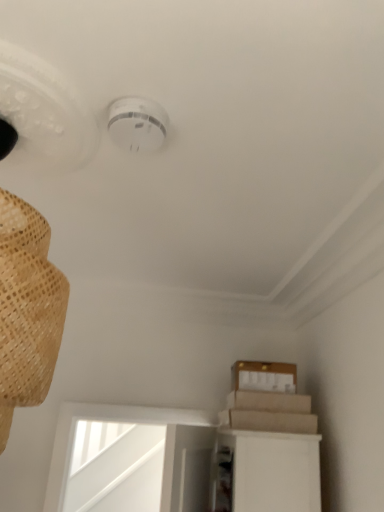
Question: Considering the positions of white plastic smoke detector at upper center and brown cardboard at upper right in the image, is white plastic smoke detector at upper center taller or shorter than brown cardboard at upper right?

Choices:
 (A) short
 (B) tall

Answer: (A)

Question: Relative to brown cardboard at upper right, is white plastic smoke detector at upper center in front or behind?

Choices:
 (A) front
 (B) behind

Answer: (A)

Question: Considering the positions of white plastic smoke detector at upper center and brown cardboard at upper right in the image, is white plastic smoke detector at upper center wider or thinner than brown cardboard at upper right?

Choices:
 (A) thin
 (B) wide

Answer: (A)

Question: Is brown cardboard at upper right spatially inside white plastic smoke detector at upper center, or outside of it?

Choices:
 (A) inside
 (B) outside

Answer: (B)

Question: From their relative heights in the image, would you say brown cardboard at upper right is taller or shorter than white plastic smoke detector at upper center?

Choices:
 (A) tall
 (B) short

Answer: (A)

Question: Considering their positions, is brown cardboard at upper right located in front of or behind white plastic smoke detector at upper center?

Choices:
 (A) behind
 (B) front

Answer: (A)

Question: From a real-world perspective, is brown cardboard at upper right above or below white plastic smoke detector at upper center?

Choices:
 (A) above
 (B) below

Answer: (B)